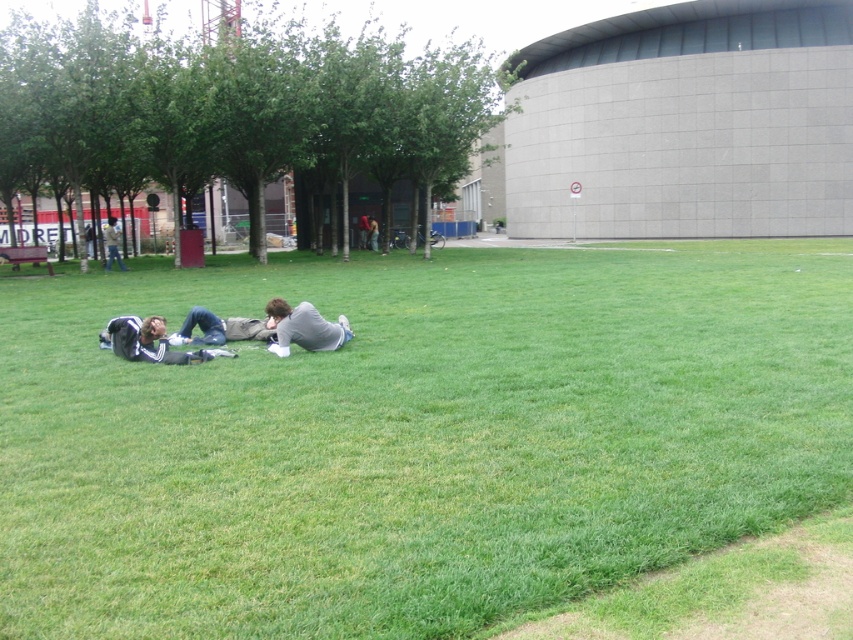
You are a person standing on the green grass at lower left and want to sit down. Is there enough space to sit comfortably without touching the dark gray fabric jacket at lower left?

The green grass at lower left is positioned over the dark gray fabric jacket at lower left, so sitting on the grass would directly involve the jacket underneath. Therefore, there might not be enough space to sit comfortably without touching the jacket.

You are standing at the origin point in the image. You want to locate the gray fabric shirt at center. In which direction should you move to reach it?

Answer: The gray fabric shirt at center is located at point (305, 326), so you should move northeast to reach it.